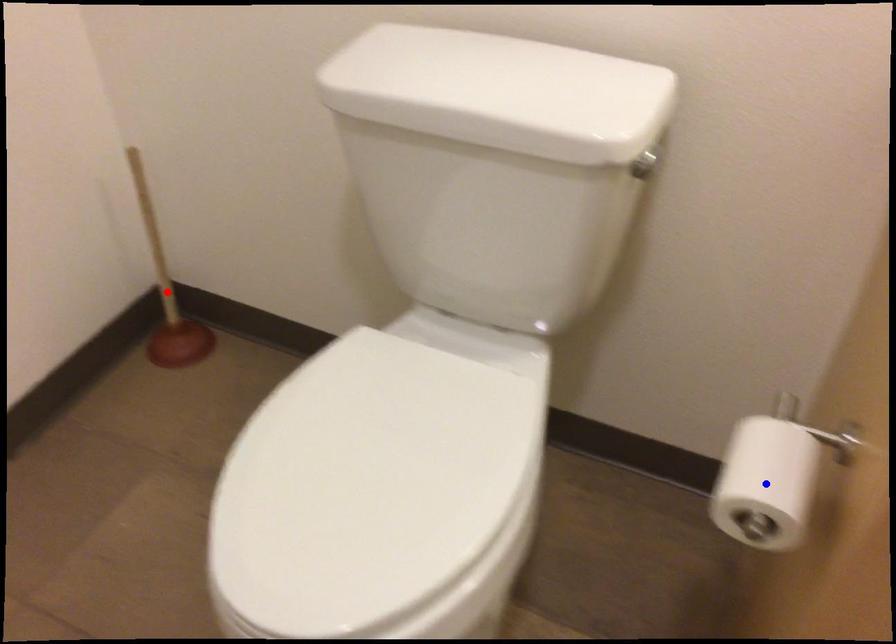
Question: In the image, two points are highlighted. Which point is nearer to the camera? Reply with the corresponding letter.

Choices:
 (A) blue point
 (B) red point

Answer: (A)